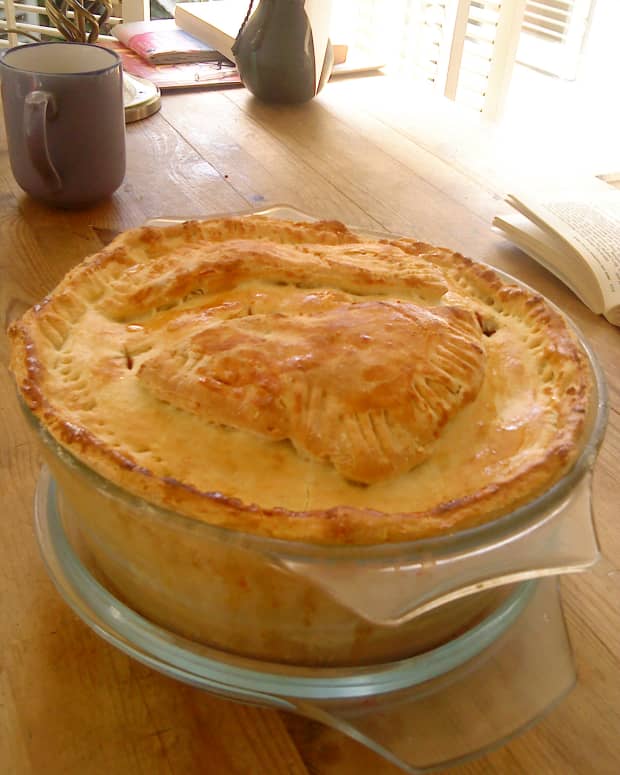
Where is `casserole dish`? Image resolution: width=620 pixels, height=775 pixels. casserole dish is located at coordinates click(289, 579).